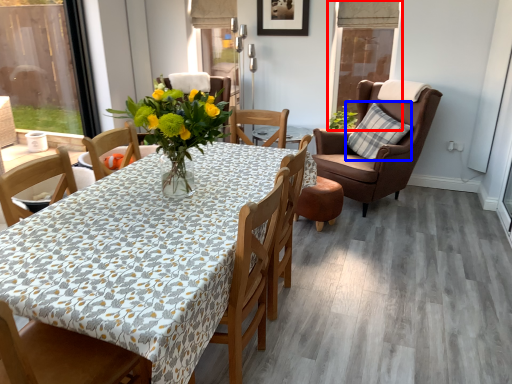
Question: Which point is further to the camera, window screen (highlighted by a red box) or pillow (highlighted by a blue box)?

Choices:
 (A) window screen
 (B) pillow

Answer: (A)